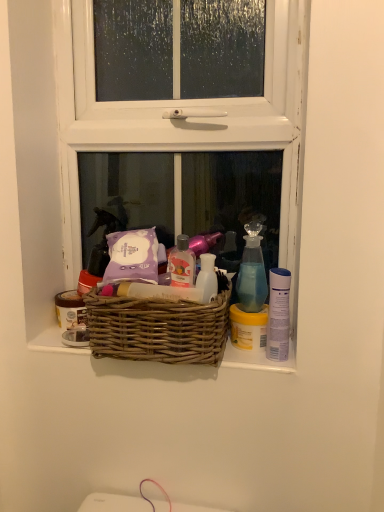
This screenshot has height=512, width=384. What do you see at coordinates (158, 329) in the screenshot?
I see `woven brown basket at center` at bounding box center [158, 329].

The height and width of the screenshot is (512, 384). What do you see at coordinates (184, 120) in the screenshot?
I see `white wooden window at center` at bounding box center [184, 120].

What is the approximate height of white wooden window at center?

white wooden window at center is 79.34 centimeters in height.

Image resolution: width=384 pixels, height=512 pixels. Identify the location of matte brown jar at left, the first toiletry when ordered from left to right. (70, 310).

In order to face yellow matte jar at right, the 1th toiletry from the front, should I rotate leftwards or rightwards?

Rotate right and turn 7.327 degrees.

Find the location of a particular element. Image resolution: width=384 pixels, height=512 pixels. woven brown basket at center is located at coordinates (158, 329).

From a real-world perspective, is woven brown basket at center physically below matte brown jar at left, the second toiletry from the right?

Incorrect, from a real-world perspective, woven brown basket at center is higher than matte brown jar at left, the second toiletry from the right.

In terms of size, does woven brown basket at center appear bigger or smaller than matte brown jar at left, the first toiletry when ordered from left to right?

woven brown basket at center is bigger than matte brown jar at left, the first toiletry when ordered from left to right.

Is matte brown jar at left, the second toiletry from the right, completely or partially inside woven brown basket at center?

No, matte brown jar at left, the second toiletry from the right, is not inside woven brown basket at center.

Considering the sizes of objects yellow matte jar at right, the second toiletry viewed from the left, and blue glass spray bottle at upper right in the image provided, who is taller, yellow matte jar at right, the second toiletry viewed from the left, or blue glass spray bottle at upper right?

blue glass spray bottle at upper right is taller.

Between yellow matte jar at right, the second toiletry viewed from the left, and blue glass spray bottle at upper right, which one has larger width?

blue glass spray bottle at upper right.

Considering the sizes of objects yellow matte jar at right, the 1th toiletry from the front, and blue glass spray bottle at upper right in the image provided, who is bigger, yellow matte jar at right, the 1th toiletry from the front, or blue glass spray bottle at upper right?

blue glass spray bottle at upper right.

Is blue glass spray bottle at upper right inside yellow matte jar at right, the first toiletry viewed from the right?

No, yellow matte jar at right, the first toiletry viewed from the right, does not contain blue glass spray bottle at upper right.

Is blue glass spray bottle at upper right bigger than woven brown basket at center?

No.

Between blue glass spray bottle at upper right and woven brown basket at center, which one has larger width?

woven brown basket at center.

Is blue glass spray bottle at upper right in front of woven brown basket at center?

No, blue glass spray bottle at upper right is further to the viewer.

From the image's perspective, which one is positioned higher, white wooden window at center or matte brown jar at left, acting as the 2th toiletry starting from the front?

white wooden window at center.

In the scene shown: Can you confirm if white wooden window at center is shorter than matte brown jar at left, acting as the 2th toiletry starting from the front?

Incorrect, the height of white wooden window at center does not fall short of that of matte brown jar at left, acting as the 2th toiletry starting from the front.

Does white wooden window at center appear on the right side of matte brown jar at left, acting as the 2th toiletry starting from the front?

Yes.

Which object is further away from the camera taking this photo, blue glass spray bottle at upper right or matte brown jar at left, the second toiletry from the right?

matte brown jar at left, the second toiletry from the right, is further away from the camera.

Considering the relative positions of blue glass spray bottle at upper right and matte brown jar at left, acting as the 1th toiletry starting from the back, in the image provided, is blue glass spray bottle at upper right to the left of matte brown jar at left, acting as the 1th toiletry starting from the back, from the viewer's perspective?

Incorrect, blue glass spray bottle at upper right is not on the left side of matte brown jar at left, acting as the 1th toiletry starting from the back.

Consider the image. Considering the relative sizes of blue glass spray bottle at upper right and matte brown jar at left, the first toiletry when ordered from left to right, in the image provided, is blue glass spray bottle at upper right taller than matte brown jar at left, the first toiletry when ordered from left to right,?

Yes.

From the picture: From the image's perspective, between blue glass spray bottle at upper right and matte brown jar at left, acting as the 2th toiletry starting from the front, who is located below?

matte brown jar at left, acting as the 2th toiletry starting from the front.

Does point (214, 337) appear closer or farther from the camera than point (258, 291)?

Clearly, point (214, 337) is closer to the camera than point (258, 291).

What are the coordinates of `cleaning product behind the woven brown basket at center` in the screenshot? It's located at (252, 271).

Considering the relative sizes of woven brown basket at center and blue glass spray bottle at upper right in the image provided, is woven brown basket at center wider than blue glass spray bottle at upper right?

Indeed, woven brown basket at center has a greater width compared to blue glass spray bottle at upper right.

Is yellow matte jar at right, arranged as the 2th toiletry when viewed from the back, situated inside white wooden window at center or outside?

yellow matte jar at right, arranged as the 2th toiletry when viewed from the back, is located beyond the bounds of white wooden window at center.

Considering the relative sizes of yellow matte jar at right, the first toiletry viewed from the right, and white wooden window at center in the image provided, is yellow matte jar at right, the first toiletry viewed from the right, taller than white wooden window at center?

Incorrect, the height of yellow matte jar at right, the first toiletry viewed from the right, is not larger of that of white wooden window at center.

From a real-world perspective, is yellow matte jar at right, the second toiletry viewed from the left, above or below white wooden window at center?

In terms of real-world spatial position, yellow matte jar at right, the second toiletry viewed from the left, is below white wooden window at center.

Where is `picnic basket on the right of matte brown jar at left, the first toiletry when ordered from left to right`? picnic basket on the right of matte brown jar at left, the first toiletry when ordered from left to right is located at coordinates (158, 329).

At what (x,y) coordinates should I click in order to perform the action: click on cleaning product located in front of the yellow matte jar at right, the 1th toiletry from the front. Please return your answer as a coordinate pair (x, y). Looking at the image, I should click on (252, 271).

Consider the image. Looking at the image, which one is located further to woven brown basket at center, yellow matte jar at right, the second toiletry viewed from the left, or matte brown jar at left, the first toiletry when ordered from left to right?

matte brown jar at left, the first toiletry when ordered from left to right, lies further to woven brown basket at center than the other object.

When comparing their distances from yellow matte jar at right, the second toiletry viewed from the left, does white wooden window at center or matte brown jar at left, the first toiletry when ordered from left to right, seem further?

Based on the image, white wooden window at center appears to be further to yellow matte jar at right, the second toiletry viewed from the left.

Which object lies further to the anchor point white wooden window at center, yellow matte jar at right, arranged as the 2th toiletry when viewed from the back, or matte brown jar at left, acting as the 1th toiletry starting from the back?

The object further to white wooden window at center is matte brown jar at left, acting as the 1th toiletry starting from the back.

Looking at the image, which one is located closer to white wooden window at center, woven brown basket at center or blue glass spray bottle at upper right?

The object closer to white wooden window at center is woven brown basket at center.

Looking at the image, which one is located closer to woven brown basket at center, white wooden window at center or matte brown jar at left, the second toiletry from the right?

→ Based on the image, matte brown jar at left, the second toiletry from the right, appears to be nearer to woven brown basket at center.

Looking at the image, which one is located further to blue glass spray bottle at upper right, woven brown basket at center or white wooden window at center?

white wooden window at center is further to blue glass spray bottle at upper right.

Based on their spatial positions, is blue glass spray bottle at upper right or matte brown jar at left, acting as the 2th toiletry starting from the front, further from woven brown basket at center?

Based on the image, matte brown jar at left, acting as the 2th toiletry starting from the front, appears to be further to woven brown basket at center.

Consider the image. Estimate the real-world distances between objects in this image. Which object is further from woven brown basket at center, white wooden window at center or yellow matte jar at right, the first toiletry viewed from the right?

white wooden window at center is positioned further to the anchor woven brown basket at center.

The height and width of the screenshot is (512, 384). Identify the location of picnic basket between white wooden window at center and yellow matte jar at right, the 1th toiletry from the front, vertically. (158, 329).

Locate an element on the screen. picnic basket between matte brown jar at left, the second toiletry from the right, and yellow matte jar at right, the first toiletry viewed from the right is located at coordinates (158, 329).

You are a GUI agent. You are given a task and a screenshot of the screen. Output one action in this format:
    pyautogui.click(x=<x>, y=<y>)
    Task: Click on the window between matte brown jar at left, the second toiletry from the right, and blue glass spray bottle at upper right from left to right
    The width and height of the screenshot is (384, 512).
    Given the screenshot: What is the action you would take?
    pyautogui.click(x=184, y=120)

Where is `picnic basket between matte brown jar at left, acting as the 1th toiletry starting from the back, and blue glass spray bottle at upper right, in the horizontal direction`? This screenshot has height=512, width=384. picnic basket between matte brown jar at left, acting as the 1th toiletry starting from the back, and blue glass spray bottle at upper right, in the horizontal direction is located at coordinates (158, 329).